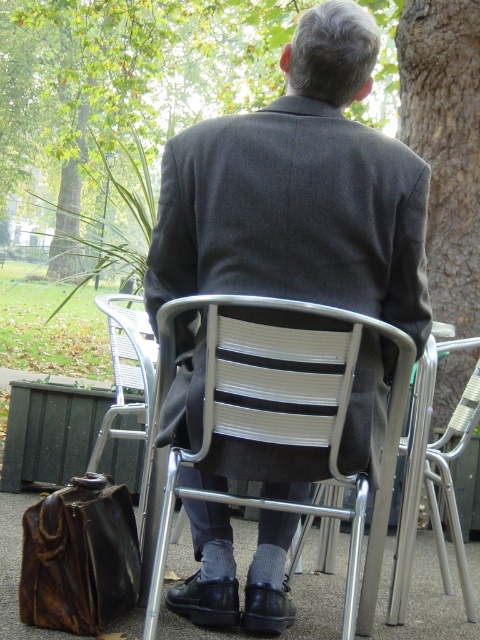
You are standing at the origin point of the coordinate system. You want to walk towards the metallic silver chair at center. What direction should you walk to reach it?

The metallic silver chair at center is located at coordinate point (283, 422), so you should walk northeast to reach it.

You are planning to place a rectangular box that is 1.2 meters wide on the ground next to the metallic silver chair at center and the leather briefcase at lower left. Based on their widths, which object can the box fit next to without overlapping?

The metallic silver chair at center has a greater width than the leather briefcase at lower left. Therefore, the box can fit next to the metallic silver chair at center since it is wider and provides more space.